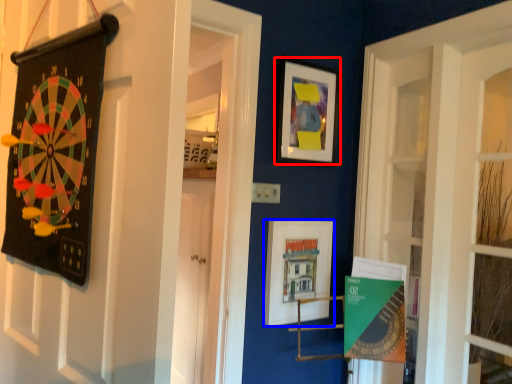
Question: Which point is closer to the camera, picture frame (highlighted by a red box) or picture frame (highlighted by a blue box)?

Choices:
 (A) picture frame
 (B) picture frame

Answer: (B)